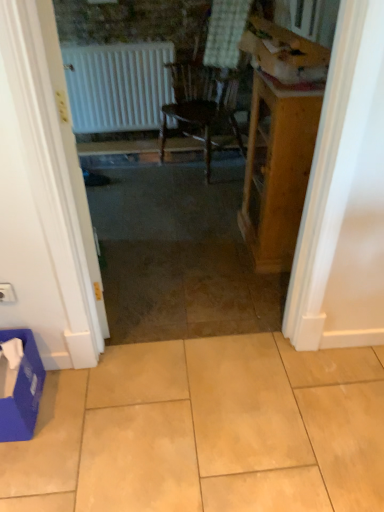
Question: Does blue cardboard box at lower left, which is the 2th cardboard box in top-to-bottom order, touch beige ceramic tile at center?

Choices:
 (A) no
 (B) yes

Answer: (A)

Question: Considering the relative sizes of blue cardboard box at lower left, which ranks as the second cardboard box in right-to-left order, and beige ceramic tile at center in the image provided, is blue cardboard box at lower left, which ranks as the second cardboard box in right-to-left order, wider than beige ceramic tile at center?

Choices:
 (A) yes
 (B) no

Answer: (B)

Question: Does blue cardboard box at lower left, which is the 2th cardboard box in top-to-bottom order, appear on the left side of beige ceramic tile at center?

Choices:
 (A) yes
 (B) no

Answer: (A)

Question: Considering the relative sizes of blue cardboard box at lower left, which is counted as the first cardboard box, starting from the bottom, and beige ceramic tile at center in the image provided, is blue cardboard box at lower left, which is counted as the first cardboard box, starting from the bottom, thinner than beige ceramic tile at center?

Choices:
 (A) no
 (B) yes

Answer: (B)

Question: Could you tell me if blue cardboard box at lower left, which ranks as the second cardboard box in right-to-left order, is facing beige ceramic tile at center?

Choices:
 (A) no
 (B) yes

Answer: (A)

Question: From the image's perspective, is white matte door at left above or below blue cardboard box at lower left, which ranks as the second cardboard box in right-to-left order?

Choices:
 (A) above
 (B) below

Answer: (A)

Question: Based on their positions, is white matte door at left located to the left or right of blue cardboard box at lower left, which appears as the 1th cardboard box when viewed from the left?

Choices:
 (A) left
 (B) right

Answer: (B)

Question: Is white matte door at left in front of or behind blue cardboard box at lower left, which ranks as the second cardboard box in right-to-left order, in the image?

Choices:
 (A) front
 (B) behind

Answer: (A)

Question: Is white matte door at left inside the boundaries of blue cardboard box at lower left, which is counted as the first cardboard box, starting from the bottom, or outside?

Choices:
 (A) inside
 (B) outside

Answer: (B)

Question: In terms of width, does white plastic electric outlet at lower left look wider or thinner when compared to white matte door at left?

Choices:
 (A) thin
 (B) wide

Answer: (A)

Question: Looking at the image, does white plastic electric outlet at lower left seem bigger or smaller compared to white matte door at left?

Choices:
 (A) big
 (B) small

Answer: (B)

Question: Would you say white plastic electric outlet at lower left is to the left or to the right of white matte door at left in the picture?

Choices:
 (A) left
 (B) right

Answer: (A)

Question: Considering the positions of point (8, 289) and point (59, 254), is point (8, 289) closer or farther from the camera than point (59, 254)?

Choices:
 (A) closer
 (B) farther

Answer: (B)

Question: Is white plastic electric outlet at lower left wider or thinner than blue cardboard box at lower left, which ranks as the second cardboard box in right-to-left order?

Choices:
 (A) wide
 (B) thin

Answer: (B)

Question: From a real-world perspective, is white plastic electric outlet at lower left physically located above or below blue cardboard box at lower left, which is counted as the first cardboard box, starting from the bottom?

Choices:
 (A) above
 (B) below

Answer: (A)